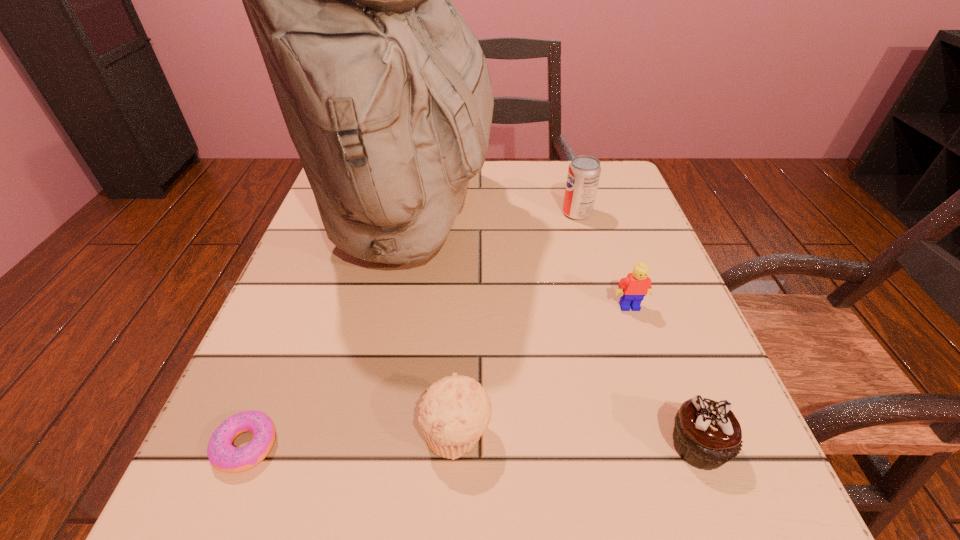
Locate which object is the closest to the muffin. Please provide its 2D coordinates. Your answer should be formatted as a tuple, i.e. [(x, y)], where the tuple contains the x and y coordinates of a point satisfying the conditions above.

[(385, 91)]

This screenshot has height=540, width=960. Find the location of `object that is the fourth nearest to the muffin`. object that is the fourth nearest to the muffin is located at coordinates (633, 288).

At what (x,y) coordinates should I click in order to perform the action: click on blank space that satisfies the following two spatial constraints: 1. on the front-facing side of the tallest object; 2. on the back side of the cupcake. Please return your answer as a coordinate pair (x, y). This screenshot has height=540, width=960. Looking at the image, I should click on (364, 446).

Where is `free space that satisfies the following two spatial constraints: 1. on the back side of the soda; 2. on the left side of the muffin`? free space that satisfies the following two spatial constraints: 1. on the back side of the soda; 2. on the left side of the muffin is located at coordinates (466, 213).

At what (x,y) coordinates should I click in order to perform the action: click on vacant space that satisfies the following two spatial constraints: 1. on the front-facing side of the backpack; 2. on the right side of the muffin. Please return your answer as a coordinate pair (x, y). Looking at the image, I should click on (366, 435).

Where is `free space that satisfies the following two spatial constraints: 1. on the back side of the cupcake; 2. on the front-facing side of the tallest object`? Image resolution: width=960 pixels, height=540 pixels. free space that satisfies the following two spatial constraints: 1. on the back side of the cupcake; 2. on the front-facing side of the tallest object is located at coordinates (613, 221).

I want to click on vacant area that satisfies the following two spatial constraints: 1. on the back side of the muffin; 2. on the right side of the second tallest object, so click(x=466, y=213).